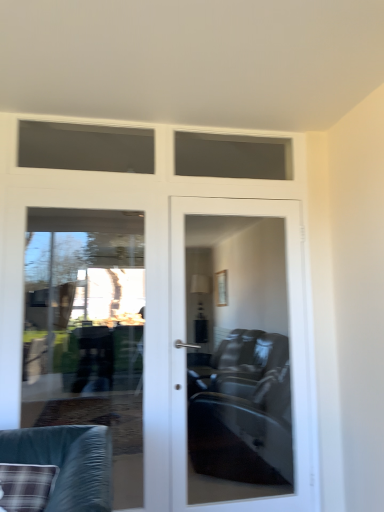
Question: Should I look upward or downward to see matte glass door at center?

Choices:
 (A) down
 (B) up

Answer: (A)

Question: Considering the relative positions of matte glass door at center and clear glass door at left in the image provided, is matte glass door at center to the right of clear glass door at left from the viewer's perspective?

Choices:
 (A) yes
 (B) no

Answer: (A)

Question: Considering the relative positions of matte glass door at center and clear glass door at left in the image provided, is matte glass door at center behind clear glass door at left?

Choices:
 (A) yes
 (B) no

Answer: (A)

Question: Considering the relative positions of matte glass door at center and clear glass door at left in the image provided, is matte glass door at center to the left of clear glass door at left from the viewer's perspective?

Choices:
 (A) yes
 (B) no

Answer: (B)

Question: Is clear glass door at left surrounded by matte glass door at center?

Choices:
 (A) no
 (B) yes

Answer: (A)

Question: Can you confirm if matte glass door at center is shorter than clear glass door at left?

Choices:
 (A) yes
 (B) no

Answer: (B)

Question: Is matte glass door at center looking in the opposite direction of clear glass door at left?

Choices:
 (A) no
 (B) yes

Answer: (A)

Question: Is clear glass door at left facing away from matte glass door at center?

Choices:
 (A) no
 (B) yes

Answer: (A)

Question: Considering the relative positions of clear glass door at left and matte glass door at center in the image provided, is clear glass door at left behind matte glass door at center?

Choices:
 (A) yes
 (B) no

Answer: (B)

Question: From the image's perspective, is clear glass door at left on top of matte glass door at center?

Choices:
 (A) yes
 (B) no

Answer: (A)

Question: From the image's perspective, is clear glass door at left below matte glass door at center?

Choices:
 (A) yes
 (B) no

Answer: (B)

Question: Is clear glass door at left closer to camera compared to matte glass door at center?

Choices:
 (A) yes
 (B) no

Answer: (A)

Question: Can you confirm if clear glass door at left is positioned to the left of matte glass door at center?

Choices:
 (A) yes
 (B) no

Answer: (A)

Question: From a real-world perspective, is clear glass door at left over plaid fabric cushion at lower left?

Choices:
 (A) yes
 (B) no

Answer: (A)